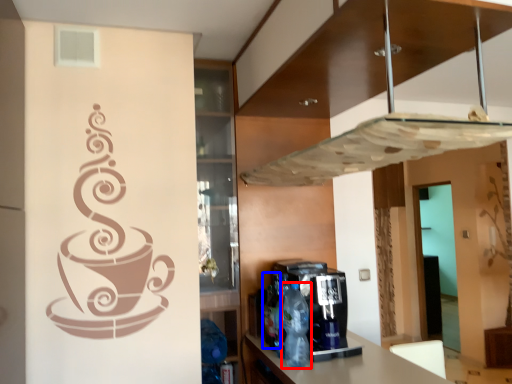
Question: Which of the following is the farthest to the observer, bottle (highlighted by a red box) or bottle (highlighted by a blue box)?

Choices:
 (A) bottle
 (B) bottle

Answer: (B)